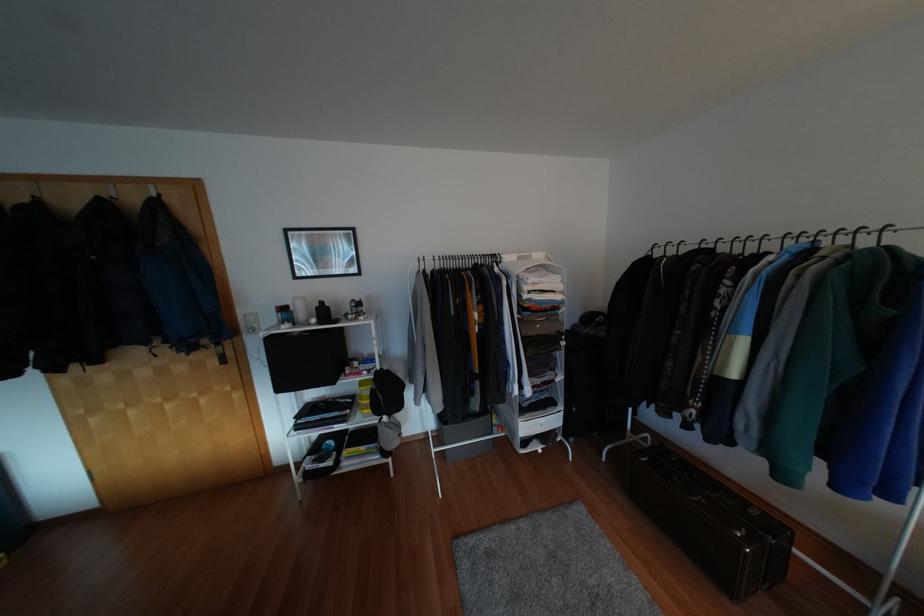
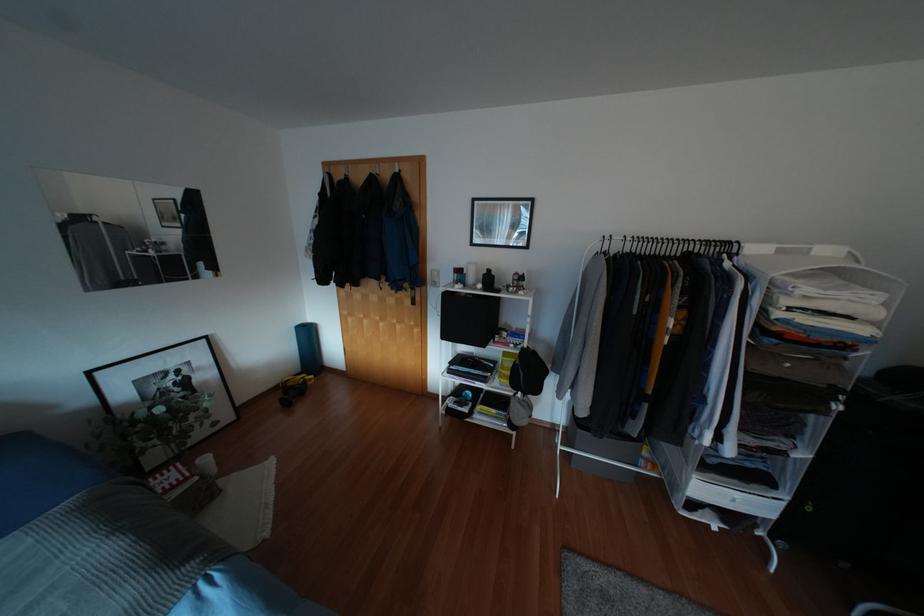
Find the pixel in the second image that matches (174,201) in the first image.

(406, 176)